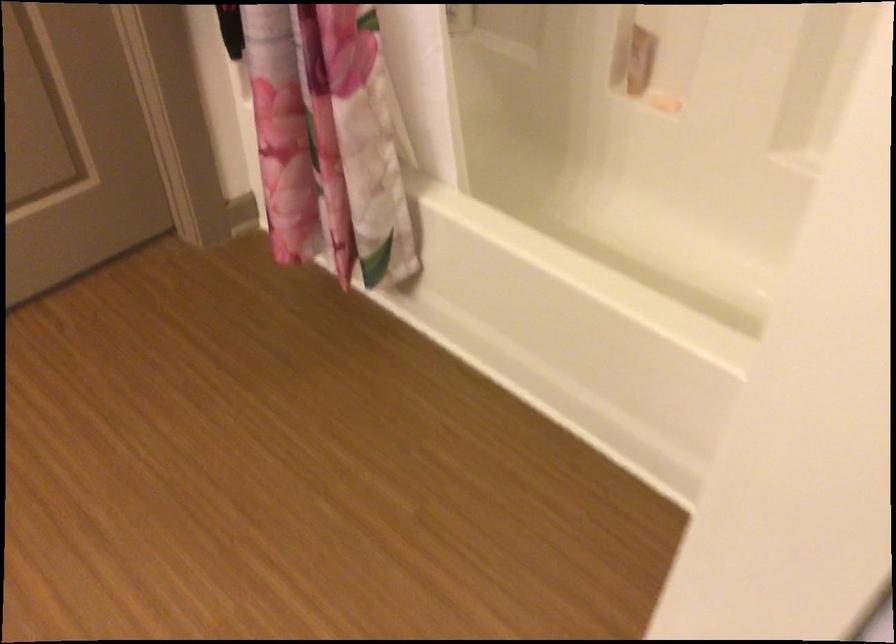
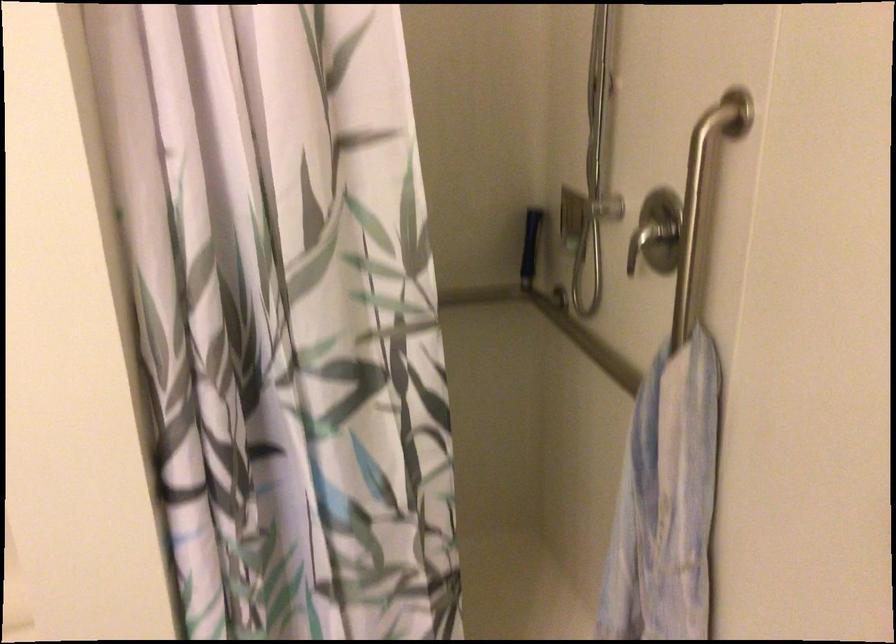
Question: The camera is either moving clockwise (left) or counter-clockwise (right) around the object. The first image is from the beginning of the video and the second image is from the end. Is the camera moving left or right when shooting the video?

Choices:
 (A) Left
 (B) Right

Answer: (A)